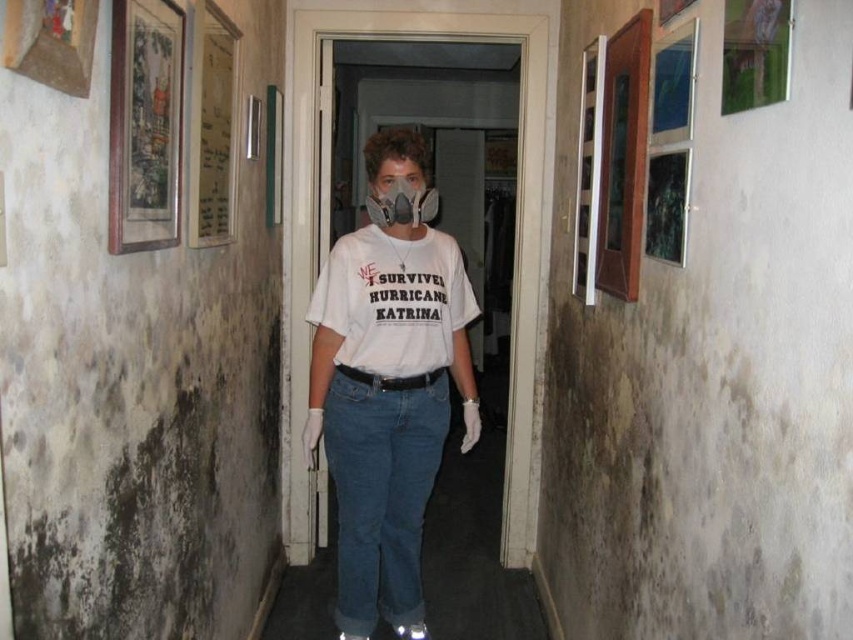
Question: Considering the relative positions of white cotton t-shirt at center and gray matte respirator at center in the image provided, where is white cotton t-shirt at center located with respect to gray matte respirator at center?

Choices:
 (A) below
 (B) above

Answer: (A)

Question: Which object appears closest to the camera in this image?

Choices:
 (A) white matte t-shirt at center
 (B) white cotton t-shirt at center

Answer: (A)

Question: Is white matte t-shirt at center wider than gray matte respirator at center?

Choices:
 (A) yes
 (B) no

Answer: (A)

Question: Which object is the closest to the white cotton t-shirt at center?

Choices:
 (A) white matte t-shirt at center
 (B) gray matte respirator at center

Answer: (A)

Question: Which of these objects is positioned closest to the gray matte respirator at center?

Choices:
 (A) white matte t-shirt at center
 (B) white cotton t-shirt at center

Answer: (B)

Question: Does white matte t-shirt at center lie in front of gray matte respirator at center?

Choices:
 (A) yes
 (B) no

Answer: (B)